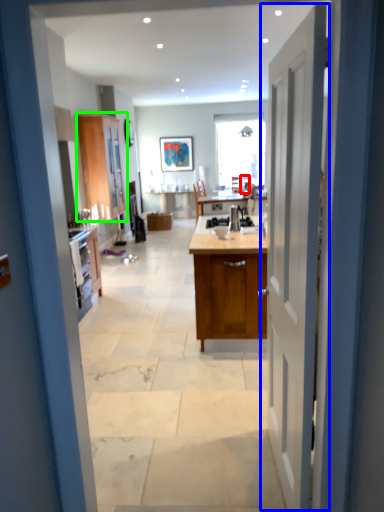
Question: Based on their relative distances, which object is farther from chair (highlighted by a red box)? Choose from door (highlighted by a blue box) and cabinetry (highlighted by a green box).

Choices:
 (A) door
 (B) cabinetry

Answer: (A)